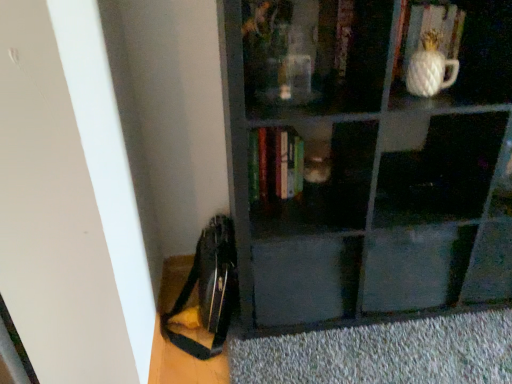
Question: Would you consider white textured vase at upper right to be distant from hardcover books at center, the first book viewed from the left?

Choices:
 (A) yes
 (B) no

Answer: (B)

Question: Can you confirm if white textured vase at upper right is positioned to the right of hardcover books at center, the 3th book when ordered from right to left?

Choices:
 (A) yes
 (B) no

Answer: (A)

Question: Is white textured vase at upper right further to the viewer compared to hardcover books at center, the first book viewed from the left?

Choices:
 (A) yes
 (B) no

Answer: (B)

Question: Is hardcover books at center, the 3th book when ordered from right to left, a part of white textured vase at upper right?

Choices:
 (A) no
 (B) yes

Answer: (A)

Question: Is the surface of white textured vase at upper right in direct contact with hardcover books at center, the 3th book when ordered from right to left?

Choices:
 (A) yes
 (B) no

Answer: (B)

Question: Can you confirm if white textured vase at upper right is shorter than hardcover books at center, the first book viewed from the left?

Choices:
 (A) yes
 (B) no

Answer: (A)

Question: Would you say matte black bookshelf at center is outside matte black drawer at center?

Choices:
 (A) yes
 (B) no

Answer: (A)

Question: Is the position of matte black bookshelf at center more distant than that of matte black drawer at center?

Choices:
 (A) yes
 (B) no

Answer: (B)

Question: Considering the relative sizes of matte black bookshelf at center and matte black drawer at center in the image provided, is matte black bookshelf at center bigger than matte black drawer at center?

Choices:
 (A) no
 (B) yes

Answer: (B)

Question: From a real-world perspective, is matte black bookshelf at center positioned under matte black drawer at center based on gravity?

Choices:
 (A) no
 (B) yes

Answer: (A)

Question: Considering the relative positions of matte black bookshelf at center and matte black drawer at center in the image provided, is matte black bookshelf at center to the right of matte black drawer at center from the viewer's perspective?

Choices:
 (A) yes
 (B) no

Answer: (A)

Question: Is matte black bookshelf at center shorter than matte black drawer at center?

Choices:
 (A) yes
 (B) no

Answer: (B)

Question: Would you say matte black drawer at center is a long distance from matte black bookshelf at center?

Choices:
 (A) no
 (B) yes

Answer: (A)